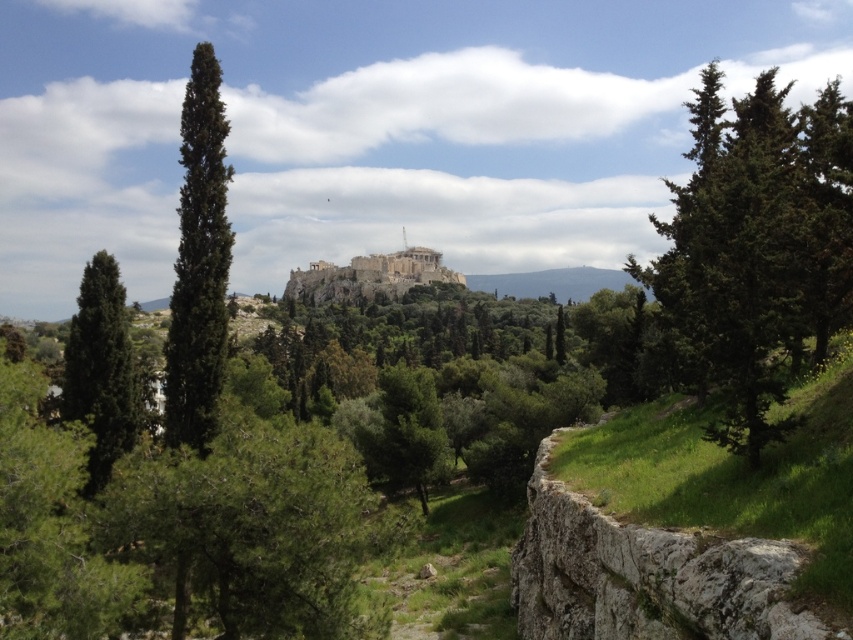
You are standing at the center of the image looking towards the Acropolis. Which direction should you walk to reach the green leafy tree at right?

The green leafy tree at right is located at point (756, 250), so you should walk towards the right side of the image to reach it.

You are standing at the base of the Acropolis and want to take a photo of the green leafy tree at right. If your camera has a maximum zoom range of 50 meters, will you be able to capture the tree clearly?

The green leafy tree at right is 41.76 meters away from the camera. Since the camera can zoom up to 50 meters, it is within the maximum range, so yes, you can capture the tree clearly.